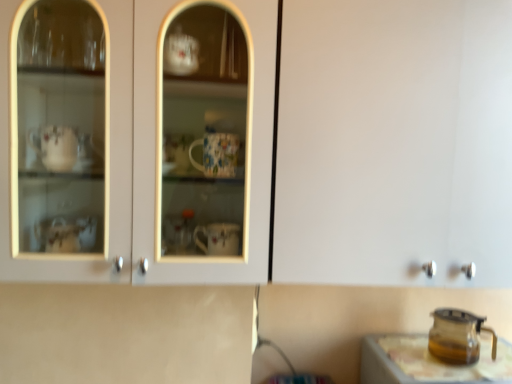
At what (x,y) coordinates should I click in order to perform the action: click on transparent glass carafe at lower right. Please return your answer as a coordinate pair (x, y). The image size is (512, 384). Looking at the image, I should click on (458, 336).

This screenshot has height=384, width=512. What do you see at coordinates (458, 336) in the screenshot?
I see `transparent glass carafe at lower right` at bounding box center [458, 336].

Find the location of a particular element. The image size is (512, 384). translucent glass table at lower right is located at coordinates (428, 362).

Describe the element at coordinates (428, 362) in the screenshot. The image size is (512, 384). I see `translucent glass table at lower right` at that location.

Locate an element on the screen. transparent glass carafe at lower right is located at coordinates (458, 336).

Considering the relative positions of translucent glass table at lower right and transparent glass carafe at lower right in the image provided, is translucent glass table at lower right to the left or to the right of transparent glass carafe at lower right?

In the image, translucent glass table at lower right appears on the right side of transparent glass carafe at lower right.

Which object is further away from the camera taking this photo, translucent glass table at lower right or transparent glass carafe at lower right?

transparent glass carafe at lower right.

Between point (388, 372) and point (436, 352), which one is positioned in front?

Positioned in front is point (388, 372).

From the image's perspective, is translucent glass table at lower right above transparent glass carafe at lower right?

No.

From a real-world perspective, who is located higher, translucent glass table at lower right or transparent glass carafe at lower right?

From a 3D spatial view, transparent glass carafe at lower right is above.

Is translucent glass table at lower right wider or thinner than transparent glass carafe at lower right?

In the image, translucent glass table at lower right appears to be wider than transparent glass carafe at lower right.

Who is taller, translucent glass table at lower right or transparent glass carafe at lower right?

Standing taller between the two is translucent glass table at lower right.

Considering the relative sizes of translucent glass table at lower right and transparent glass carafe at lower right in the image provided, is translucent glass table at lower right bigger than transparent glass carafe at lower right?

Yes, translucent glass table at lower right is bigger than transparent glass carafe at lower right.

Would you say transparent glass carafe at lower right is part of translucent glass table at lower right's contents?

No, transparent glass carafe at lower right is not a part of translucent glass table at lower right.

Is translucent glass table at lower right not near transparent glass carafe at lower right?

translucent glass table at lower right is near transparent glass carafe at lower right, not far away.

Does translucent glass table at lower right turn towards transparent glass carafe at lower right?

No, translucent glass table at lower right is not turned towards transparent glass carafe at lower right.

The height and width of the screenshot is (384, 512). I want to click on appliance to the left of translucent glass table at lower right, so click(458, 336).

Based on the photo, is transparent glass carafe at lower right to the left or to the right of translucent glass table at lower right in the image?

Clearly, transparent glass carafe at lower right is on the left of translucent glass table at lower right in the image.

Between transparent glass carafe at lower right and translucent glass table at lower right, which one is positioned in front?

translucent glass table at lower right is closer to the camera.

Does point (456, 329) appear closer or farther from the camera than point (486, 344)?

Point (456, 329).

From the image's perspective, is transparent glass carafe at lower right positioned above or below translucent glass table at lower right?

Clearly, from the image's perspective, transparent glass carafe at lower right is above translucent glass table at lower right.

From a real-world perspective, which object rests below the other?

In real-world perspective, translucent glass table at lower right is lower.

Which object is wider, transparent glass carafe at lower right or translucent glass table at lower right?

With larger width is translucent glass table at lower right.

From their relative heights in the image, would you say transparent glass carafe at lower right is taller or shorter than translucent glass table at lower right?

Clearly, transparent glass carafe at lower right is shorter compared to translucent glass table at lower right.

Does transparent glass carafe at lower right have a larger size compared to translucent glass table at lower right?

No, transparent glass carafe at lower right is not bigger than translucent glass table at lower right.

Looking at this image, is transparent glass carafe at lower right not inside translucent glass table at lower right?

Yes, transparent glass carafe at lower right is not within translucent glass table at lower right.

Is transparent glass carafe at lower right next to translucent glass table at lower right and touching it?

Yes, transparent glass carafe at lower right is beside translucent glass table at lower right.

Is transparent glass carafe at lower right oriented away from translucent glass table at lower right?

That's not correct — transparent glass carafe at lower right is not looking away from translucent glass table at lower right.

In the scene shown: Measure the distance from transparent glass carafe at lower right to translucent glass table at lower right.

transparent glass carafe at lower right and translucent glass table at lower right are 3.31 inches apart from each other.

Locate an element on the screen. This screenshot has width=512, height=384. table below the transparent glass carafe at lower right (from the image's perspective) is located at coordinates (428, 362).

Find the location of `appliance located above the translucent glass table at lower right (from a real-world perspective)`. appliance located above the translucent glass table at lower right (from a real-world perspective) is located at coordinates (458, 336).

This screenshot has height=384, width=512. In order to click on table in front of the transparent glass carafe at lower right in this screenshot , I will do `click(428, 362)`.